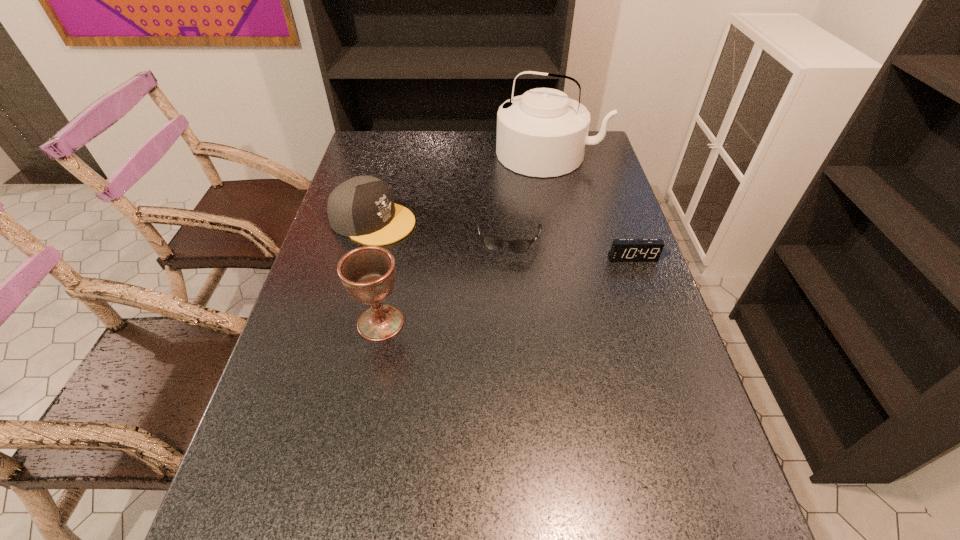
The height and width of the screenshot is (540, 960). Identify the location of free space located on the front-facing side of the third tallest object. (517, 271).

At what (x,y) coordinates should I click in order to perform the action: click on free location located 0.080m on the front-facing side of the third tallest object. Please return your answer as a coordinate pair (x, y). This screenshot has width=960, height=540. Looking at the image, I should click on (432, 240).

You are a GUI agent. You are given a task and a screenshot of the screen. Output one action in this format:
    pyautogui.click(x=<x>, y=<y>)
    Task: Click on the blank space located 0.290m on the spout of the kettle
    The width and height of the screenshot is (960, 540).
    Given the screenshot: What is the action you would take?
    pyautogui.click(x=512, y=229)

This screenshot has width=960, height=540. Identify the location of vacant area situated 0.170m on the spout of the kettle. (522, 206).

What are the coordinates of `vacant area situated 0.170m on the spout of the kettle` in the screenshot? It's located at (522, 206).

Where is `vacant area situated 0.060m on the front-facing side of the sunglasses`? vacant area situated 0.060m on the front-facing side of the sunglasses is located at coordinates (503, 274).

Locate an element on the screen. free location located 0.280m on the front-facing side of the sunglasses is located at coordinates (492, 340).

The width and height of the screenshot is (960, 540). In order to click on vacant space positioned on the front-facing side of the sunglasses in this screenshot , I will do `click(498, 301)`.

The image size is (960, 540). I want to click on object at the far edge, so click(x=543, y=133).

At what (x,y) coordinates should I click in order to perform the action: click on chalice present at the left edge. Please return your answer as a coordinate pair (x, y). This screenshot has width=960, height=540. Looking at the image, I should click on (367, 273).